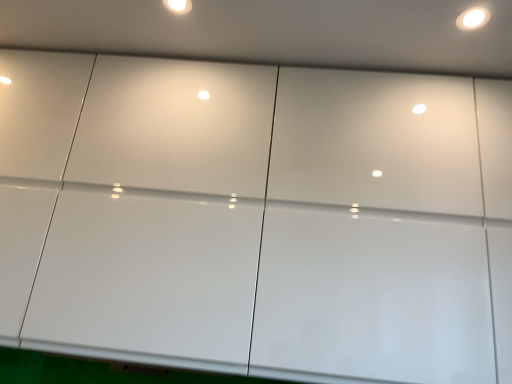
Question: Looking at the image, does white glossy light fixture at upper center seem bigger or smaller compared to white glossy light at upper right?

Choices:
 (A) small
 (B) big

Answer: (A)

Question: From the image's perspective, is white glossy light fixture at upper center above or below white glossy light at upper right?

Choices:
 (A) below
 (B) above

Answer: (B)

Question: From their relative heights in the image, would you say white glossy light fixture at upper center is taller or shorter than white glossy light at upper right?

Choices:
 (A) tall
 (B) short

Answer: (B)

Question: Considering the positions of white glossy light at upper right and white glossy light fixture at upper center in the image, is white glossy light at upper right taller or shorter than white glossy light fixture at upper center?

Choices:
 (A) short
 (B) tall

Answer: (B)

Question: Looking at the image, does white glossy light at upper right seem bigger or smaller compared to white glossy light fixture at upper center?

Choices:
 (A) big
 (B) small

Answer: (A)

Question: From a real-world perspective, is white glossy light at upper right above or below white glossy light fixture at upper center?

Choices:
 (A) below
 (B) above

Answer: (A)

Question: In terms of width, does white glossy light at upper right look wider or thinner when compared to white glossy light fixture at upper center?

Choices:
 (A) thin
 (B) wide

Answer: (B)